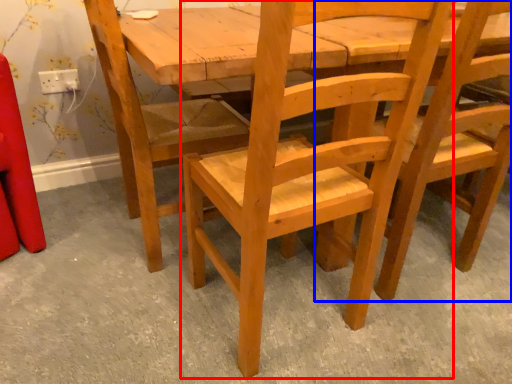
Question: Which object appears farthest to the camera in this image, chair (highlighted by a red box) or chair (highlighted by a blue box)?

Choices:
 (A) chair
 (B) chair

Answer: (B)